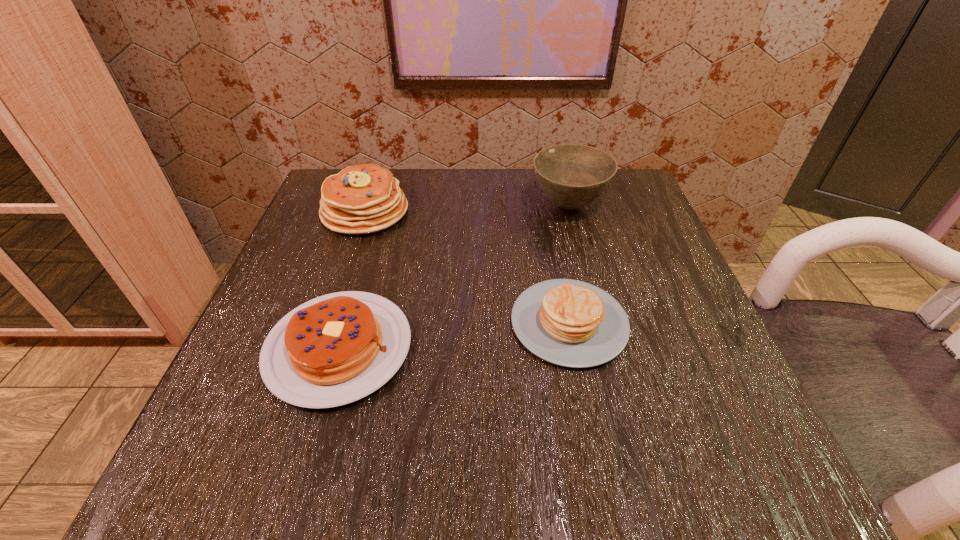
Where is `free area in between the bowl and the rightmost pancake`? This screenshot has height=540, width=960. free area in between the bowl and the rightmost pancake is located at coordinates (569, 264).

You are a GUI agent. You are given a task and a screenshot of the screen. Output one action in this format:
    pyautogui.click(x=<x>, y=<y>)
    Task: Click on the free point between the bowl and the rightmost pancake
    
    Given the screenshot: What is the action you would take?
    pyautogui.click(x=569, y=264)

Identify which object is the second nearest to the rightmost pancake. Please provide its 2D coordinates. Your answer should be formatted as a tuple, i.e. [(x, y)], where the tuple contains the x and y coordinates of a point satisfying the conditions above.

[(572, 176)]

Identify the location of the third closest object to the rightmost pancake. The height and width of the screenshot is (540, 960). (361, 199).

At what (x,y) coordinates should I click in order to perform the action: click on the closest pancake to the tallest pancake. Please return your answer as a coordinate pair (x, y). This screenshot has width=960, height=540. Looking at the image, I should click on (335, 349).

Select which pancake appears as the second closest to the bowl. Please provide its 2D coordinates. Your answer should be formatted as a tuple, i.e. [(x, y)], where the tuple contains the x and y coordinates of a point satisfying the conditions above.

[(361, 199)]